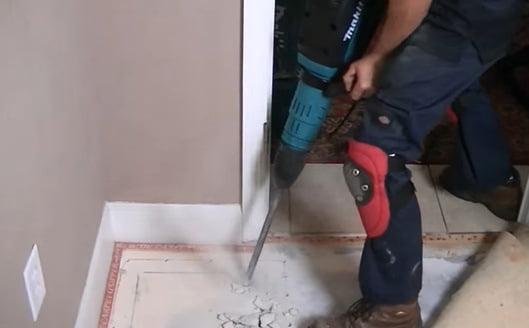
Find the location of a particular element. The width and height of the screenshot is (529, 328). shoe is located at coordinates (389, 314), (504, 202).